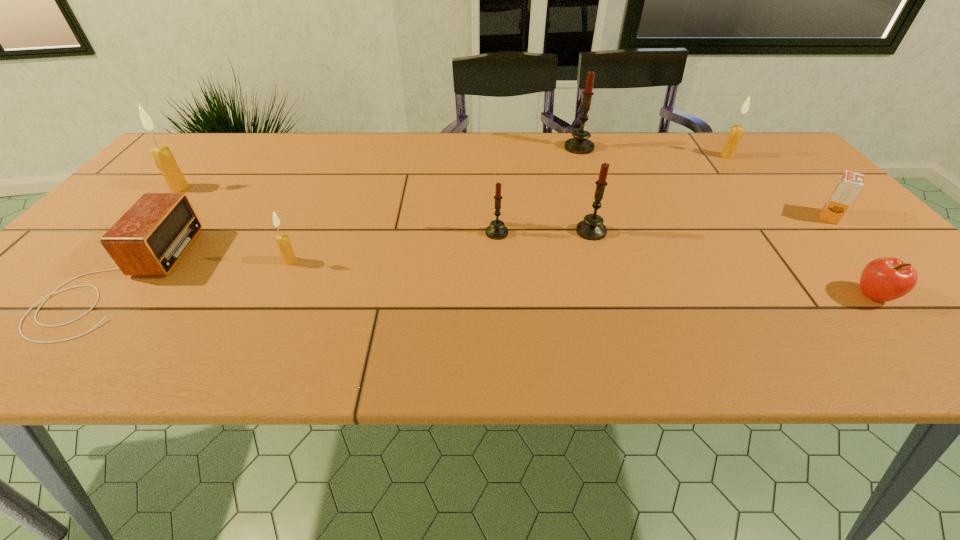
In order to click on orange juice in this screenshot , I will do `click(849, 185)`.

Locate an element on the screen. The image size is (960, 540). apple is located at coordinates (885, 279).

The image size is (960, 540). Identify the location of vacant area situated 0.050m on the front of the farthest red candle. (585, 163).

Locate an element on the screen. The image size is (960, 540). free space located on the front of the leftmost candle is located at coordinates (134, 239).

This screenshot has width=960, height=540. Identify the location of free region located 0.170m on the right of the second smallest red candle. (679, 231).

Find the location of a particular element. vacant space located 0.280m on the front of the rightmost cream candle is located at coordinates (776, 217).

Identify the location of free location located on the front of the sixth object from right to left. (498, 266).

At what (x,y) coordinates should I click in order to perform the action: click on vacant space located on the left of the nearest cream candle. Please return your answer as a coordinate pair (x, y). This screenshot has height=540, width=960. Looking at the image, I should click on (257, 261).

Where is `vacant area situated 0.400m on the left of the orange juice`? Image resolution: width=960 pixels, height=540 pixels. vacant area situated 0.400m on the left of the orange juice is located at coordinates (652, 217).

At what (x,y) coordinates should I click in order to perform the action: click on free space located 0.240m on the back of the pink apple. Please return your answer as a coordinate pair (x, y). This screenshot has width=960, height=540. Looking at the image, I should click on (801, 213).